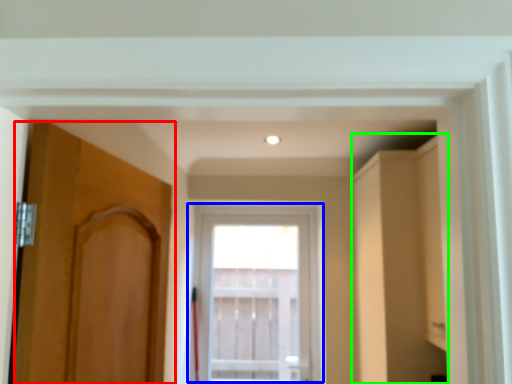
Question: Considering the real-world distances, which object is closest to door (highlighted by a red box)? window (highlighted by a blue box) or cabinetry (highlighted by a green box).

Choices:
 (A) window
 (B) cabinetry

Answer: (B)